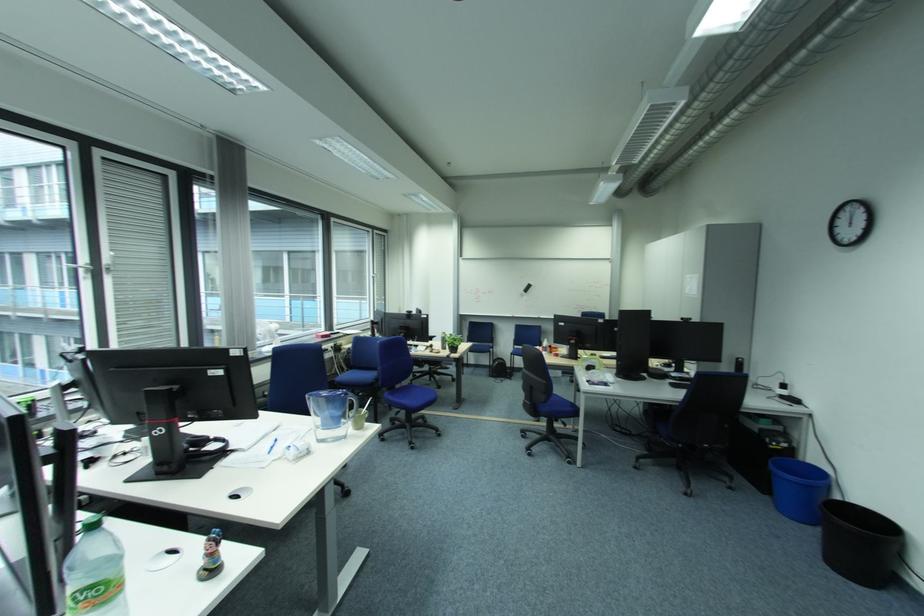
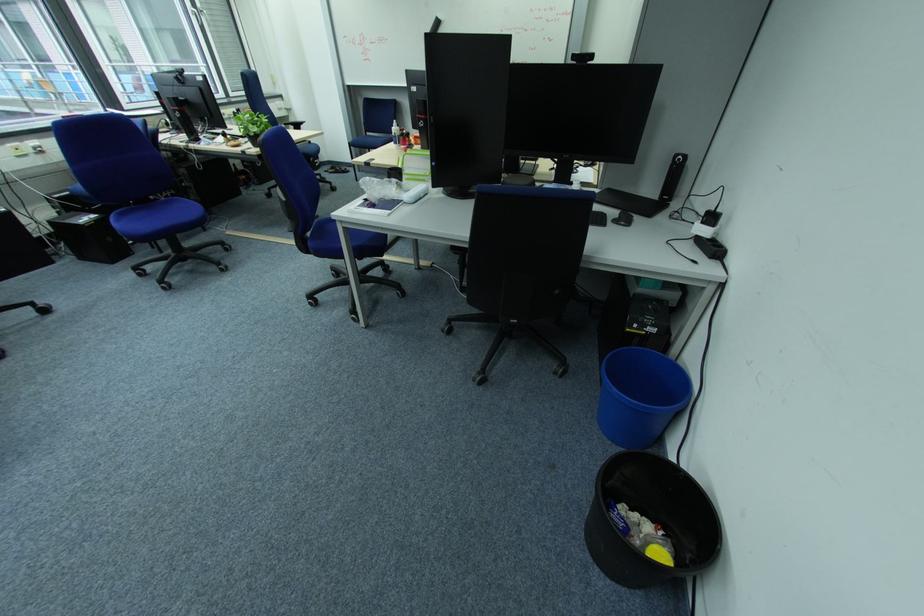
In the second image, find the point that corresponds to point 747,360 in the first image.

(686, 156)